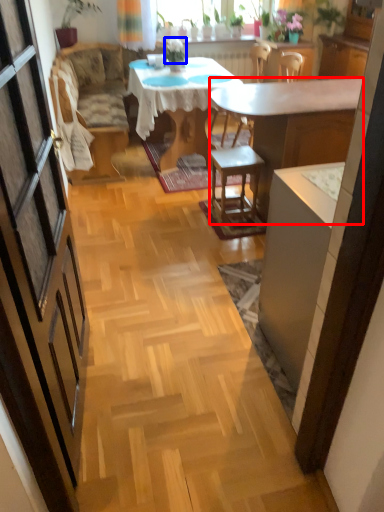
Question: Which object appears closest to the camera in this image, desk (highlighted by a red box) or plant (highlighted by a blue box)?

Choices:
 (A) desk
 (B) plant

Answer: (A)